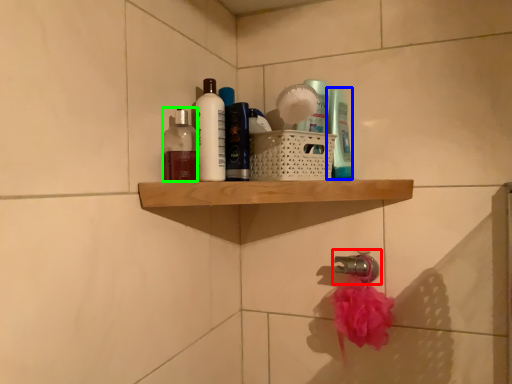
Question: Estimate the real-world distances between objects in this image. Which object is closer to tap (highlighted by a red box), toiletry (highlighted by a blue box) or toiletry (highlighted by a green box)?

Choices:
 (A) toiletry
 (B) toiletry

Answer: (A)